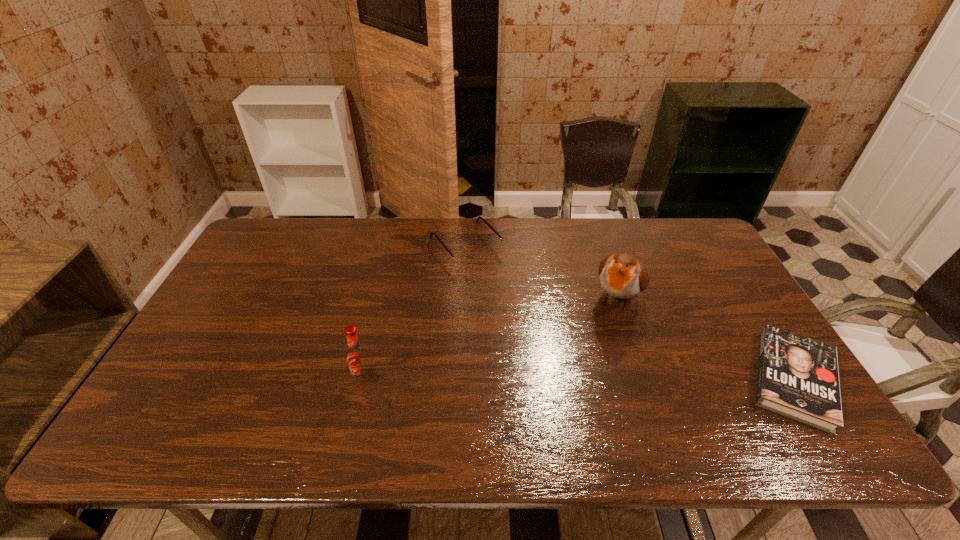
Locate an element on the screen. The height and width of the screenshot is (540, 960). vacant space positioned at the face of the second farthest object is located at coordinates (564, 409).

Locate an element on the screen. The height and width of the screenshot is (540, 960). vacant space located 0.110m at the face of the second farthest object is located at coordinates (597, 348).

Locate an element on the screen. The width and height of the screenshot is (960, 540). vacant space located 0.350m at the hinge ends of the second object from left to right is located at coordinates (549, 340).

Locate an element on the screen. free space located at the hinge ends of the second object from left to right is located at coordinates (543, 332).

You are a GUI agent. You are given a task and a screenshot of the screen. Output one action in this format:
    pyautogui.click(x=<x>, y=<y>)
    Task: Click on the vacant space located at the hinge ends of the second object from left to right
    
    Given the screenshot: What is the action you would take?
    pyautogui.click(x=517, y=303)

Find the location of `object at the far edge`. object at the far edge is located at coordinates (466, 257).

You are a GUI agent. You are given a task and a screenshot of the screen. Output one action in this format:
    pyautogui.click(x=<x>, y=<y>)
    Task: Click on the root beer situated at the near edge
    The width and height of the screenshot is (960, 540).
    Given the screenshot: What is the action you would take?
    pyautogui.click(x=358, y=358)

Identify the location of book that is at the near edge. tap(798, 377).

Identify the location of object at the right edge. The image size is (960, 540). (798, 377).

Identify the location of object that is at the near right corner. This screenshot has height=540, width=960. (798, 377).